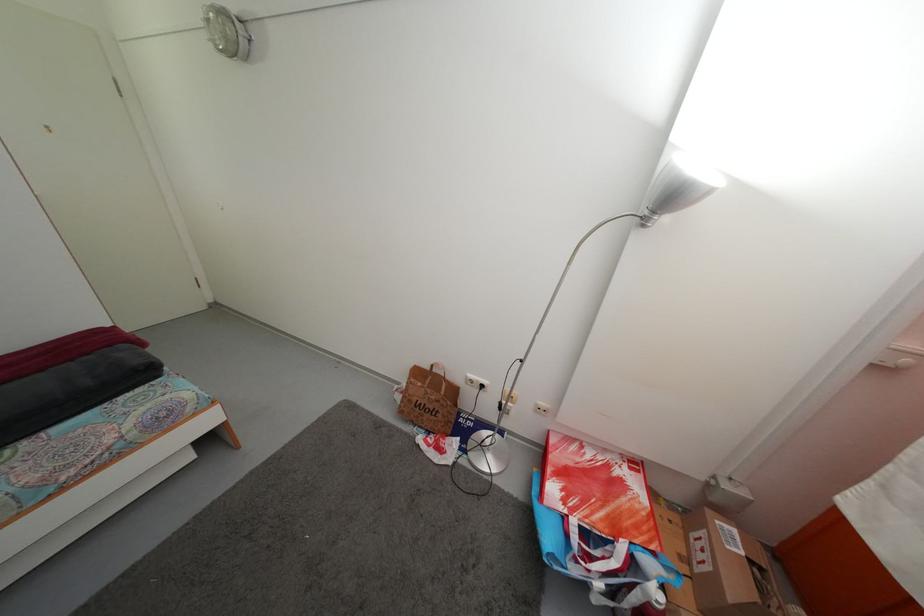
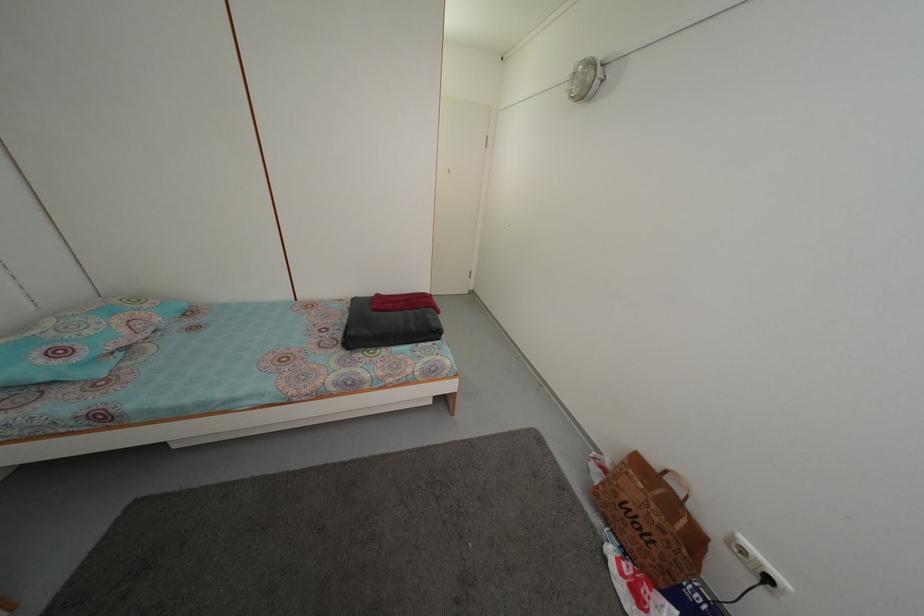
Locate, in the second image, the point that corresponds to point (488, 392) in the first image.

(774, 588)